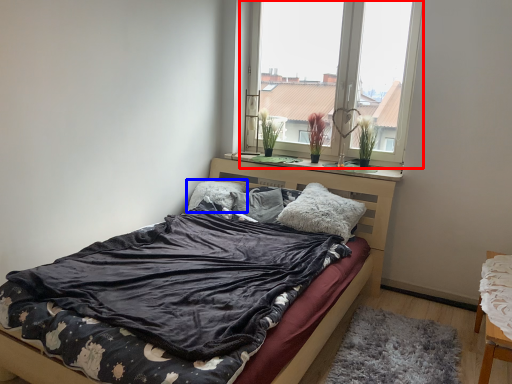
Question: Which point is further to the camera, window (highlighted by a red box) or pillow (highlighted by a blue box)?

Choices:
 (A) window
 (B) pillow

Answer: (B)